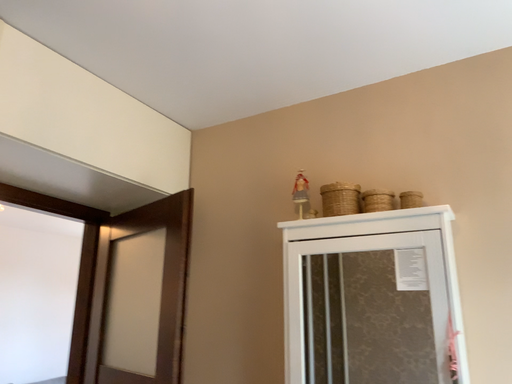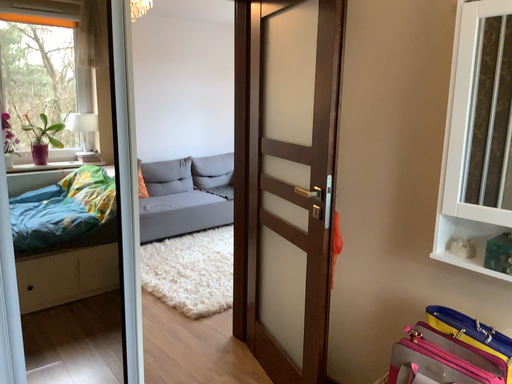
Question: Which way did the camera rotate in the video?

Choices:
 (A) rotated upward
 (B) rotated downward

Answer: (B)